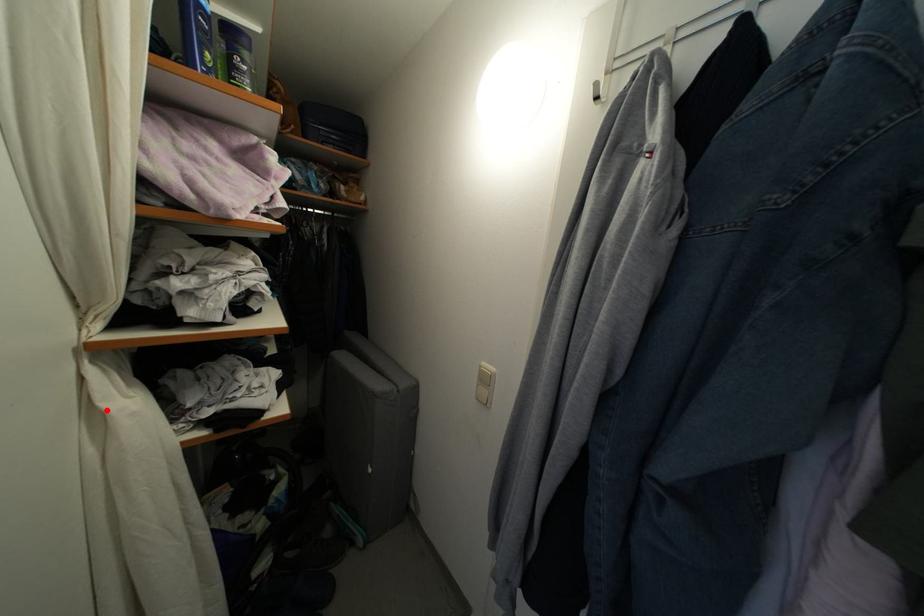
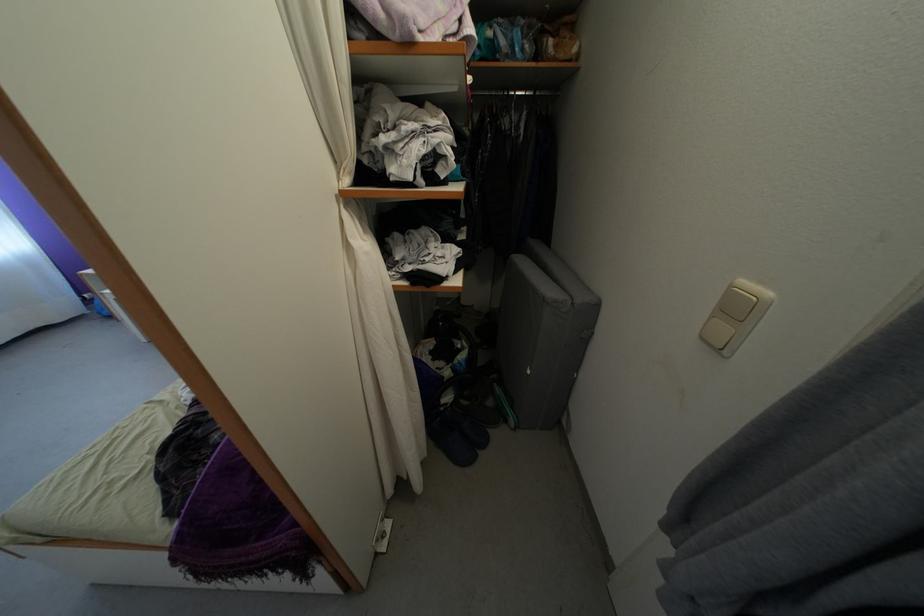
The point at the highlighted location is marked in the first image. Where is the corresponding point in the second image?

(356, 246)